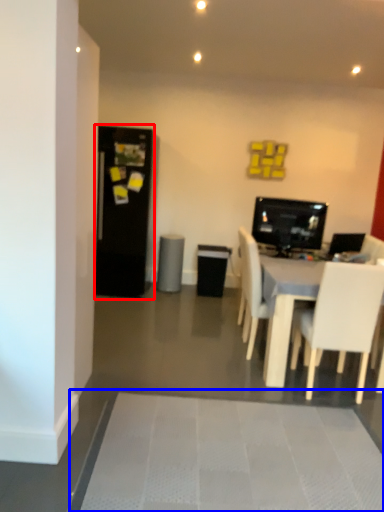
Question: Which point is further to the camera, fridge (highlighted by a red box) or bath mat (highlighted by a blue box)?

Choices:
 (A) fridge
 (B) bath mat

Answer: (A)